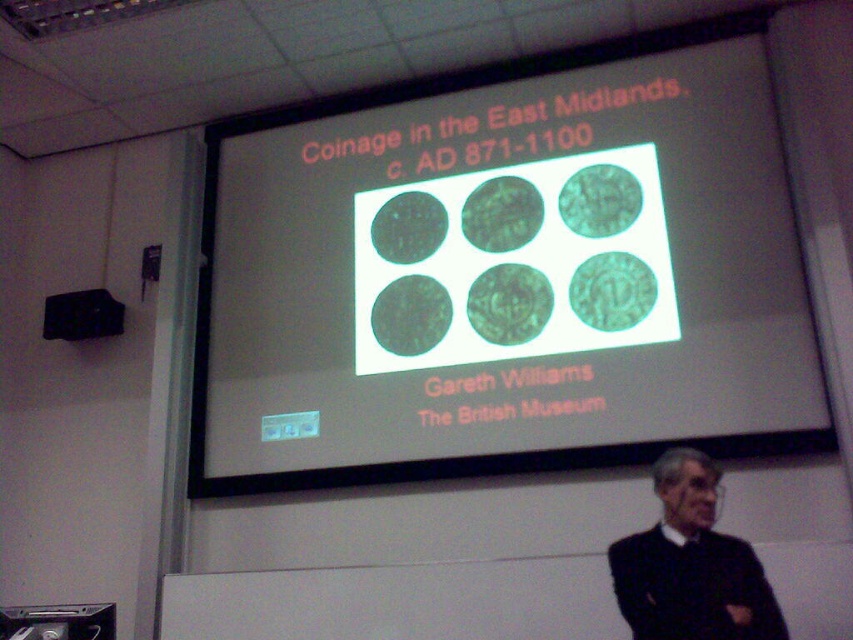
Question: Does black fabric at lower right come behind black plastic speaker at upper left?

Choices:
 (A) yes
 (B) no

Answer: (B)

Question: Among these points, which one is farthest from the camera?

Choices:
 (A) (91, 320)
 (B) (722, 540)

Answer: (A)

Question: Is black fabric at lower right to the right of black plastic speaker at upper left from the viewer's perspective?

Choices:
 (A) no
 (B) yes

Answer: (B)

Question: Which point appears closest to the camera in this image?

Choices:
 (A) (630, 593)
 (B) (70, 321)

Answer: (A)

Question: Is black fabric at lower right further to camera compared to black plastic speaker at upper left?

Choices:
 (A) yes
 (B) no

Answer: (B)